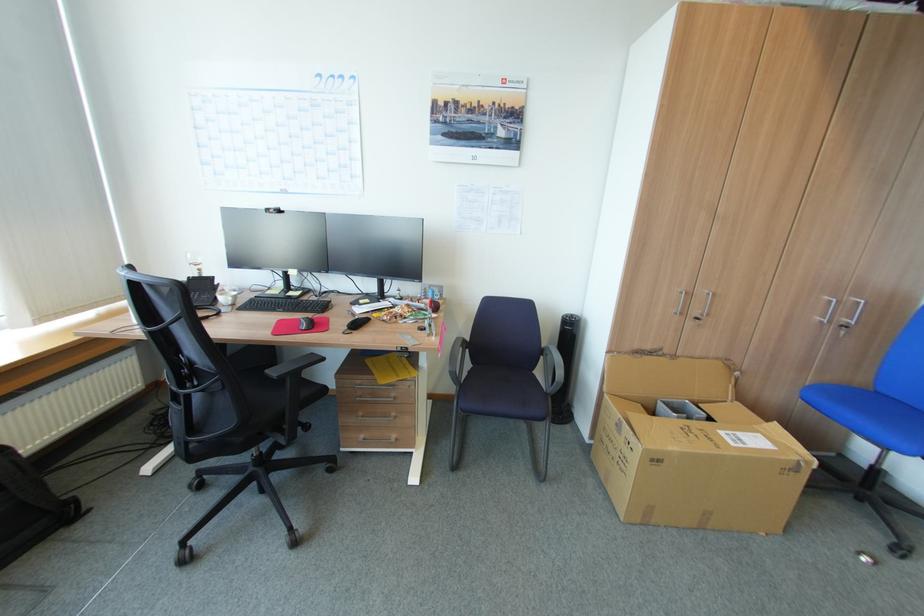
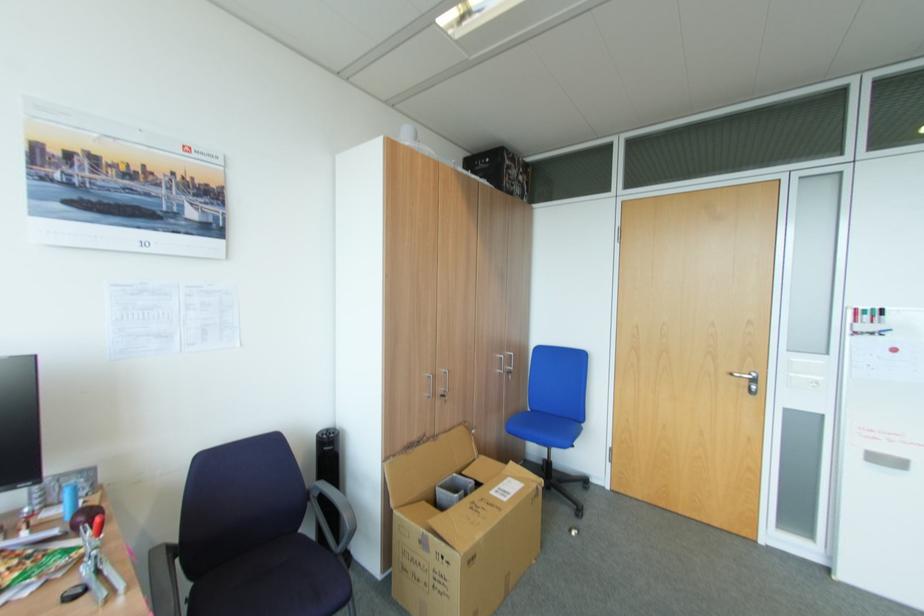
In the second image, find the point that corresponds to point (807, 399) in the first image.

(515, 431)